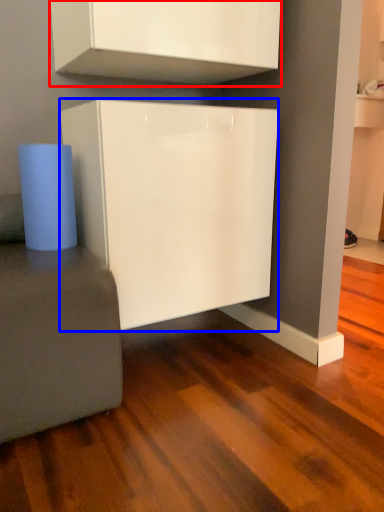
Question: Which point is further to the camera, cabinetry (highlighted by a red box) or cabinetry (highlighted by a blue box)?

Choices:
 (A) cabinetry
 (B) cabinetry

Answer: (B)